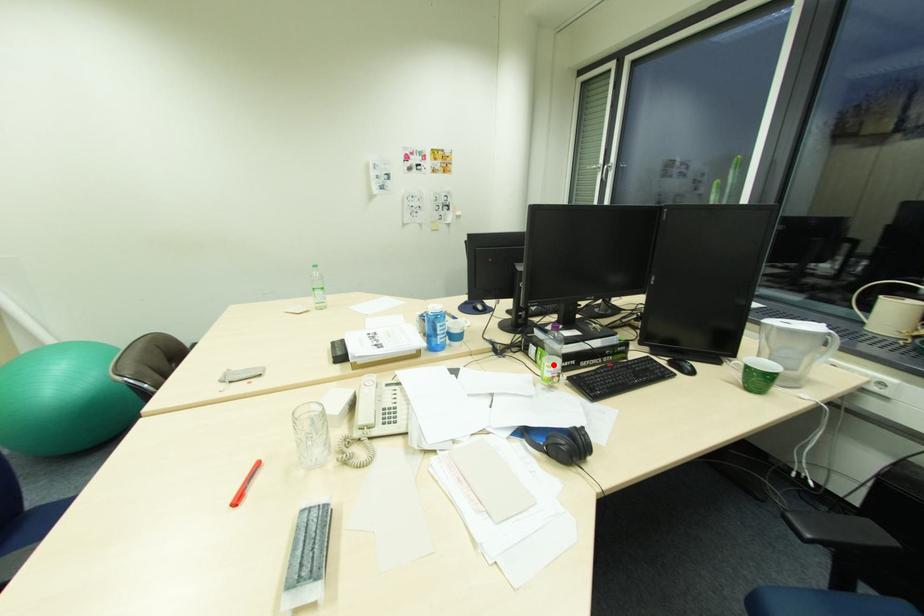
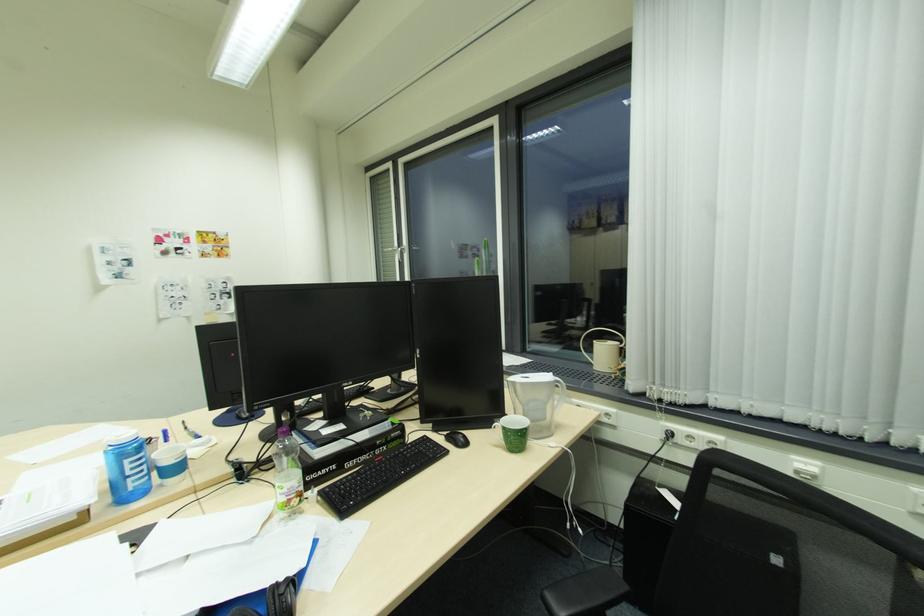
Locate, in the second image, the point that corresponds to the highlighted location in the first image.

(286, 485)